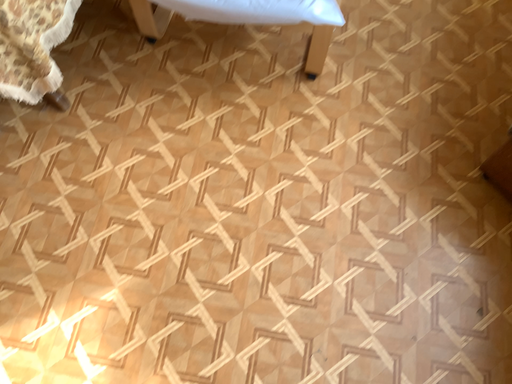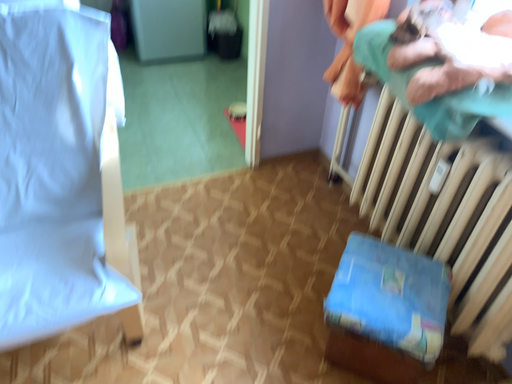
Question: Which way did the camera rotate in the video?

Choices:
 (A) rotated upward
 (B) rotated downward

Answer: (A)